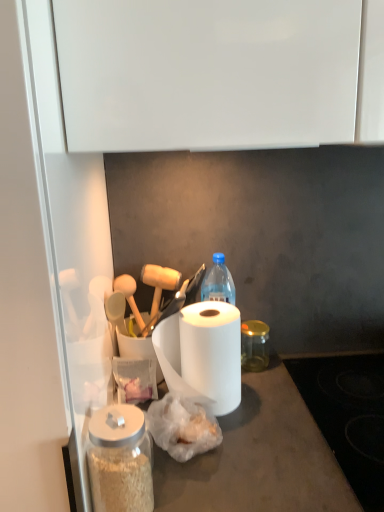
Find the location of `translucent plastic bag at center`. translucent plastic bag at center is located at coordinates (182, 426).

Identify the location of transparent glass jar at lower left, which ranks as the 2th glass jar in back-to-front order. This screenshot has height=512, width=384. (120, 460).

Image resolution: width=384 pixels, height=512 pixels. Describe the element at coordinates (254, 345) in the screenshot. I see `transparent glass jar at center, the 1th glass jar from the back` at that location.

The height and width of the screenshot is (512, 384). Identify the location of translucent plastic bag at center. (182, 426).

From a real-world perspective, between white matte paper towel at center and transparent glass jar at center, which is the second glass jar from left to right, who is vertically lower?

transparent glass jar at center, which is the second glass jar from left to right, is physically lower.

Is white matte paper towel at center next to transparent glass jar at center, placed as the second glass jar when sorted from front to back, and touching it?

No.

Could you measure the distance between white matte paper towel at center and transparent glass jar at center, arranged as the first glass jar when viewed from the right?

white matte paper towel at center and transparent glass jar at center, arranged as the first glass jar when viewed from the right, are 24.01 centimeters apart from each other.

Is white matte paper towel at center wider or thinner than transparent glass jar at center, arranged as the first glass jar when viewed from the right?

In the image, white matte paper towel at center appears to be wider than transparent glass jar at center, arranged as the first glass jar when viewed from the right.

Between translucent plastic bag at center and transparent glass jar at center, which is the second glass jar from left to right, which one has smaller width?

transparent glass jar at center, which is the second glass jar from left to right.

From the image's perspective, is translucent plastic bag at center below transparent glass jar at center, placed as the second glass jar when sorted from front to back?

Yes, from the image's perspective, translucent plastic bag at center is below transparent glass jar at center, placed as the second glass jar when sorted from front to back.

Who is more distant, translucent plastic bag at center or transparent glass jar at center, placed as the second glass jar when sorted from front to back?

transparent glass jar at center, placed as the second glass jar when sorted from front to back.

Is point (249, 368) positioned before point (162, 407)?

No, (249, 368) is behind (162, 407).

From a real-world perspective, is transparent glass jar at center, which is the second glass jar from left to right, positioned over translucent plastic bag at center based on gravity?

Yes.

Is transparent glass jar at center, the 1th glass jar from the back, in contact with translucent plastic bag at center?

No, transparent glass jar at center, the 1th glass jar from the back, is not in contact with translucent plastic bag at center.

Could you tell me if transparent glass jar at center, which is the second glass jar from left to right, is turned towards translucent plastic bag at center?

No, transparent glass jar at center, which is the second glass jar from left to right, does not turn towards translucent plastic bag at center.

Does point (100, 497) appear closer or farther from the camera than point (227, 407)?

Point (100, 497).

In the scene shown: In terms of height, does transparent glass jar at lower left, which ranks as the 2th glass jar in back-to-front order, look taller or shorter compared to white matte paper towel at center?

In the image, transparent glass jar at lower left, which ranks as the 2th glass jar in back-to-front order, appears to be shorter than white matte paper towel at center.

From the image's perspective, is transparent glass jar at lower left, which ranks as the 2th glass jar in back-to-front order, positioned above or below white matte paper towel at center?

From the image's perspective, transparent glass jar at lower left, which ranks as the 2th glass jar in back-to-front order, appears below white matte paper towel at center.

From the picture: Is transparent glass jar at lower left, the first glass jar viewed from the left, touching white matte paper towel at center?

No, transparent glass jar at lower left, the first glass jar viewed from the left, is not making contact with white matte paper towel at center.

From a real-world perspective, is transparent glass jar at lower left, which ranks as the 2th glass jar in back-to-front order, over transparent glass jar at center, arranged as the first glass jar when viewed from the right?

Indeed, from a real-world perspective, transparent glass jar at lower left, which ranks as the 2th glass jar in back-to-front order, stands above transparent glass jar at center, arranged as the first glass jar when viewed from the right.

Considering the relative sizes of transparent glass jar at lower left, which ranks as the 2th glass jar in back-to-front order, and transparent glass jar at center, which is the second glass jar from left to right, in the image provided, is transparent glass jar at lower left, which ranks as the 2th glass jar in back-to-front order, thinner than transparent glass jar at center, which is the second glass jar from left to right,?

No.

Considering the relative sizes of transparent glass jar at lower left, which ranks as the 2th glass jar in back-to-front order, and transparent glass jar at center, the 1th glass jar from the back, in the image provided, is transparent glass jar at lower left, which ranks as the 2th glass jar in back-to-front order, shorter than transparent glass jar at center, the 1th glass jar from the back,?

No, transparent glass jar at lower left, which ranks as the 2th glass jar in back-to-front order, is not shorter than transparent glass jar at center, the 1th glass jar from the back.

Is white matte paper towel at center located within translucent plastic bag at center?

No.

In the scene shown: Considering the sizes of translucent plastic bag at center and white matte paper towel at center in the image, is translucent plastic bag at center wider or thinner than white matte paper towel at center?

Considering their sizes, translucent plastic bag at center looks slimmer than white matte paper towel at center.

In terms of height, does translucent plastic bag at center look taller or shorter compared to white matte paper towel at center?

translucent plastic bag at center is shorter than white matte paper towel at center.

From a real-world perspective, who is located lower, translucent plastic bag at center or white matte paper towel at center?

translucent plastic bag at center.

Consider the image. Is white matte paper towel at center bigger than translucent plastic bag at center?

Indeed, white matte paper towel at center has a larger size compared to translucent plastic bag at center.

From the picture: Does white matte paper towel at center come in front of translucent plastic bag at center?

No, the depth of white matte paper towel at center is greater than that of translucent plastic bag at center.

Considering the relative sizes of white matte paper towel at center and translucent plastic bag at center in the image provided, is white matte paper towel at center wider than translucent plastic bag at center?

Indeed, white matte paper towel at center has a greater width compared to translucent plastic bag at center.

From the image's perspective, between white matte paper towel at center and translucent plastic bag at center, who is located below?

translucent plastic bag at center.

You are a GUI agent. You are given a task and a screenshot of the screen. Output one action in this format:
    pyautogui.click(x=<x>, y=<y>)
    Task: Click on the paper towel in front of the transparent glass jar at center, arranged as the first glass jar when viewed from the right
    Image resolution: width=384 pixels, height=512 pixels.
    Given the screenshot: What is the action you would take?
    pyautogui.click(x=202, y=354)

The image size is (384, 512). Identify the location of food below the transparent glass jar at center, arranged as the first glass jar when viewed from the right (from a real-world perspective). tap(182, 426).

From the image, which object appears to be farther from white matte paper towel at center, translucent plastic bag at center or transparent glass jar at center, arranged as the first glass jar when viewed from the right?

transparent glass jar at center, arranged as the first glass jar when viewed from the right, is positioned further to the anchor white matte paper towel at center.

Based on their spatial positions, is transparent glass jar at lower left, the first glass jar viewed from the left, or transparent glass jar at center, which is the second glass jar from left to right, closer to translucent plastic bag at center?

Among the two, transparent glass jar at lower left, the first glass jar viewed from the left, is located nearer to translucent plastic bag at center.

Which object lies further to the anchor point translucent plastic bag at center, transparent glass jar at center, which is the second glass jar from left to right, or white matte paper towel at center?

Among the two, transparent glass jar at center, which is the second glass jar from left to right, is located further to translucent plastic bag at center.

Consider the image. From the image, which object appears to be nearer to translucent plastic bag at center, transparent glass jar at center, which is the second glass jar from left to right, or transparent glass jar at lower left, the second glass jar in the right-to-left sequence?

transparent glass jar at lower left, the second glass jar in the right-to-left sequence.

Estimate the real-world distances between objects in this image. Which object is closer to transparent glass jar at center, the 1th glass jar from the back, translucent plastic bag at center or transparent glass jar at lower left, the second glass jar in the right-to-left sequence?

The object closer to transparent glass jar at center, the 1th glass jar from the back, is translucent plastic bag at center.

From the picture: Looking at the image, which one is located further to translucent plastic bag at center, white matte paper towel at center or transparent glass jar at lower left, which ranks as the 2th glass jar in back-to-front order?

transparent glass jar at lower left, which ranks as the 2th glass jar in back-to-front order, lies further to translucent plastic bag at center than the other object.

When comparing their distances from white matte paper towel at center, does translucent plastic bag at center or transparent glass jar at lower left, the first glass jar viewed from the left, seem further?

Among the two, transparent glass jar at lower left, the first glass jar viewed from the left, is located further to white matte paper towel at center.

Which object lies nearer to the anchor point translucent plastic bag at center, white matte paper towel at center or transparent glass jar at center, placed as the second glass jar when sorted from front to back?

white matte paper towel at center.

Identify the location of food between transparent glass jar at lower left, the second glass jar in the right-to-left sequence, and transparent glass jar at center, placed as the second glass jar when sorted from front to back, along the z-axis. Image resolution: width=384 pixels, height=512 pixels. (182, 426).

Where is `food located between transparent glass jar at lower left, which ranks as the 2th glass jar in back-to-front order, and white matte paper towel at center in the depth direction`? This screenshot has width=384, height=512. food located between transparent glass jar at lower left, which ranks as the 2th glass jar in back-to-front order, and white matte paper towel at center in the depth direction is located at coordinates (182, 426).

Locate an element on the screen. paper towel positioned between transparent glass jar at lower left, which ranks as the 2th glass jar in back-to-front order, and transparent glass jar at center, arranged as the first glass jar when viewed from the right, from near to far is located at coordinates (202, 354).

At what (x,y) coordinates should I click in order to perform the action: click on paper towel positioned between translucent plastic bag at center and transparent glass jar at center, placed as the second glass jar when sorted from front to back, from near to far. Please return your answer as a coordinate pair (x, y). The width and height of the screenshot is (384, 512). Looking at the image, I should click on (202, 354).